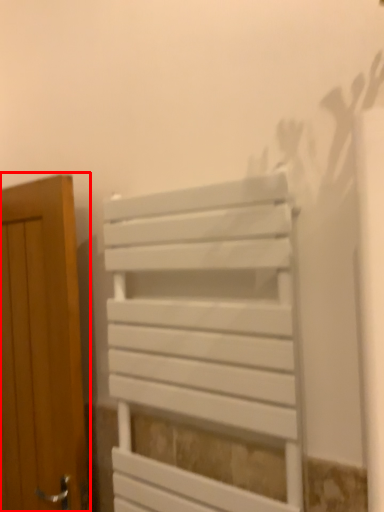
Question: From the image's perspective, where is door (annotated by the red box) located in relation to furniture in the image?

Choices:
 (A) below
 (B) above

Answer: (A)